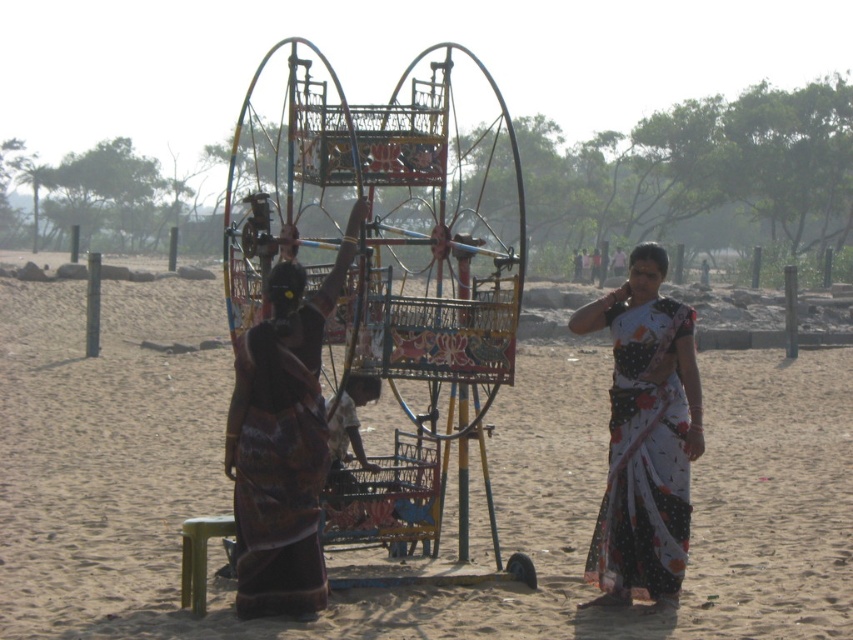
Question: Is painted metal ferris wheel at center in front of metallic painted ferris wheel at center?

Choices:
 (A) no
 (B) yes

Answer: (A)

Question: Which of these objects is positioned farthest from the metallic painted ferris wheel at center?

Choices:
 (A) white dotted saree at center
 (B) brown sand at center
 (C) dark brown textured fabric dress at left
 (D) painted metal ferris wheel at center

Answer: (A)

Question: Which object is positioned closest to the metallic painted ferris wheel at center?

Choices:
 (A) white dotted saree at center
 (B) brown sand at center

Answer: (B)

Question: Which object appears closest to the camera in this image?

Choices:
 (A) brown sand at center
 (B) dark brown fabric saree at center
 (C) painted metal ferris wheel at center
 (D) dark brown textured fabric dress at left

Answer: (A)

Question: Does dark brown fabric saree at center appear on the right side of dark brown textured fabric dress at left?

Choices:
 (A) yes
 (B) no

Answer: (A)

Question: Can you confirm if brown sand at center is positioned to the right of dark brown textured fabric dress at left?

Choices:
 (A) yes
 (B) no

Answer: (A)